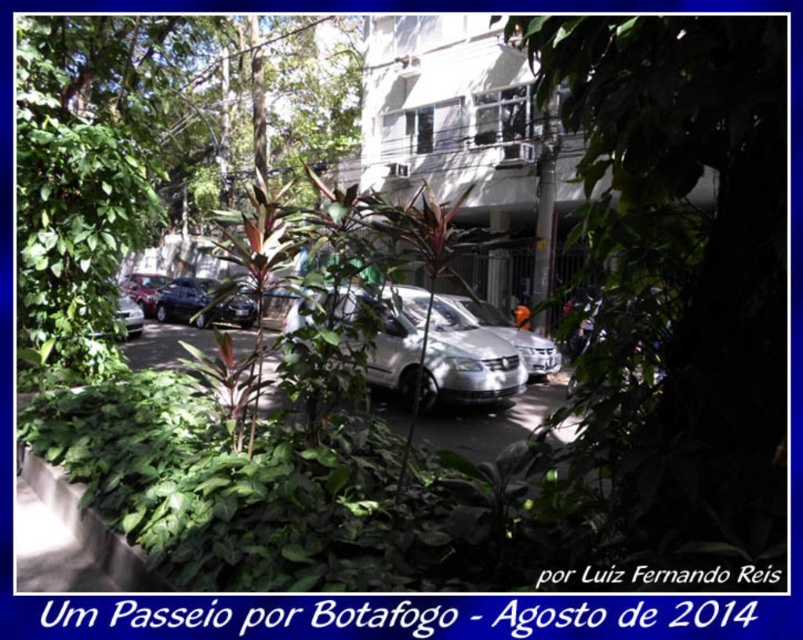
You are a delivery person trying to navigate through the street in Botafogo, Rio de Janeiro. You see the green leafy plant at center and the silver metallic car at center. Which object is blocking your view of the other?

The green leafy plant at center is located above the silver metallic car at center, so the plant is blocking the view of the car.

You are a pedestrian standing on the street in Botafogo, Rio de Janeiro, Brazil. You notice a green leafy tree at center and a green leafy plant at center. Which one is closer to you?

The green leafy tree at center is closer to the viewer than the green leafy plant at center.